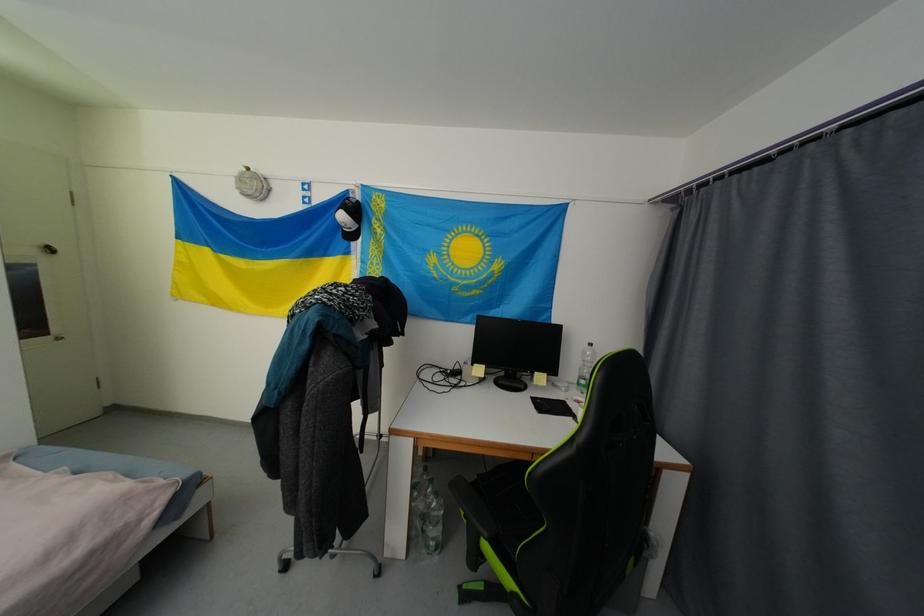
Where would you resting arm the black chair armrest? Please return your answer as a coordinate pair (x, y).

(472, 506)